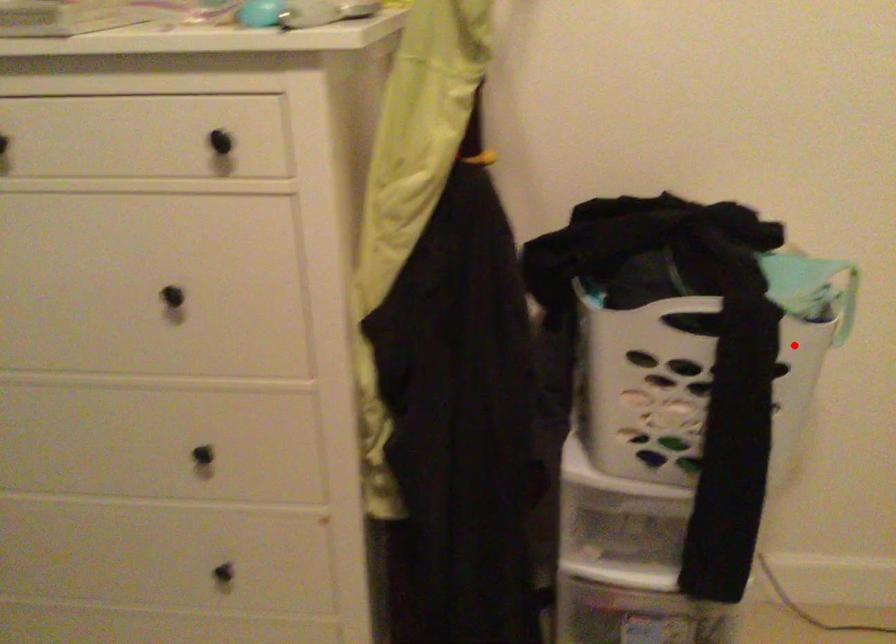
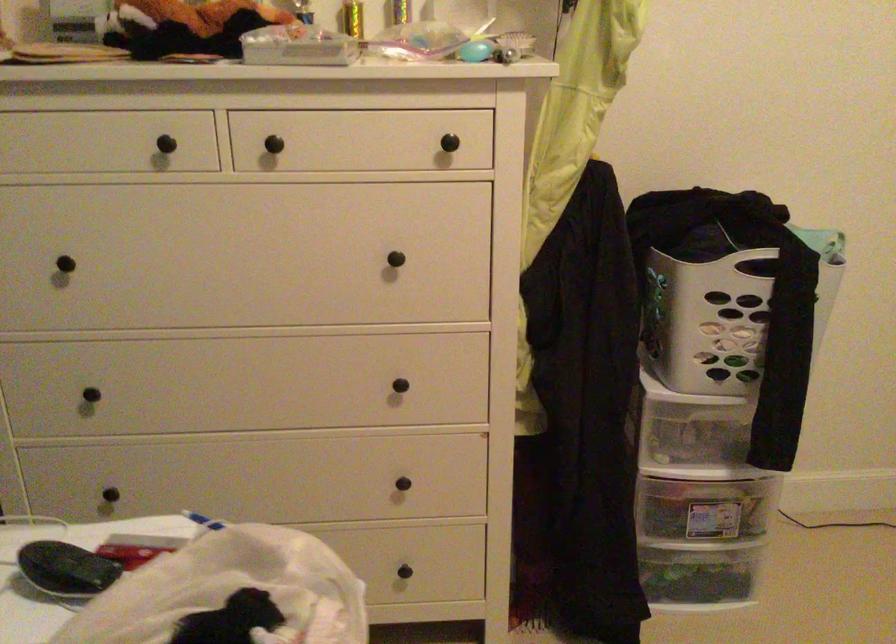
In the second image, find the point that corresponds to the highlighted location in the first image.

(829, 277)